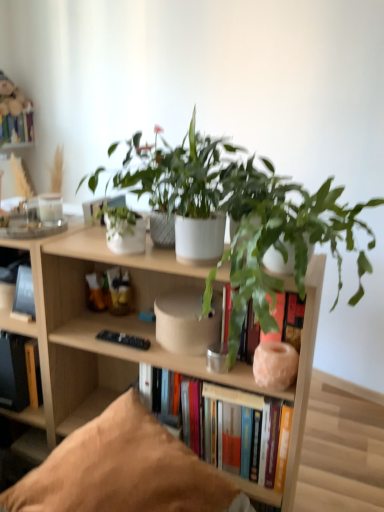
Where is `free space above wooden bookcase at center (from a real-world perspective)`? The image size is (384, 512). free space above wooden bookcase at center (from a real-world perspective) is located at coordinates click(x=83, y=238).